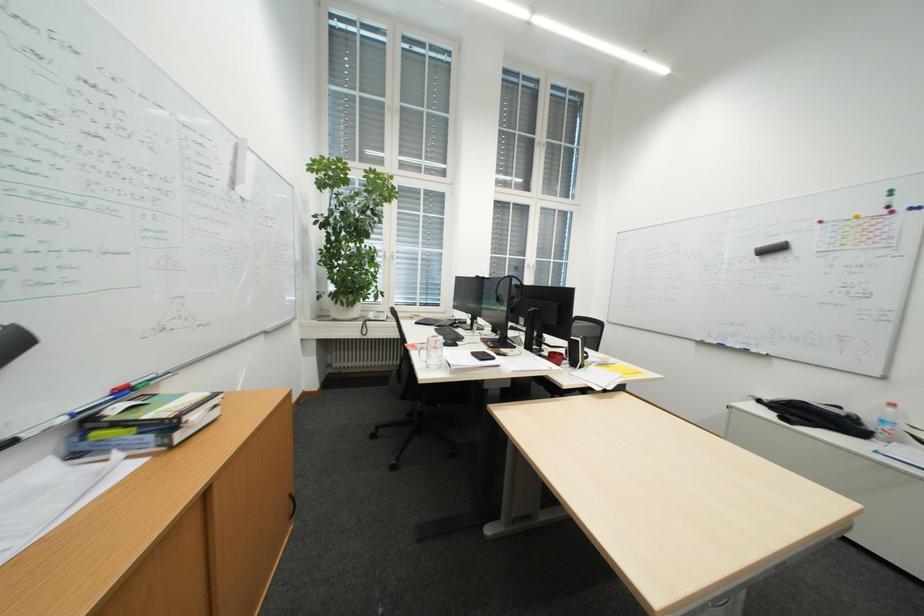
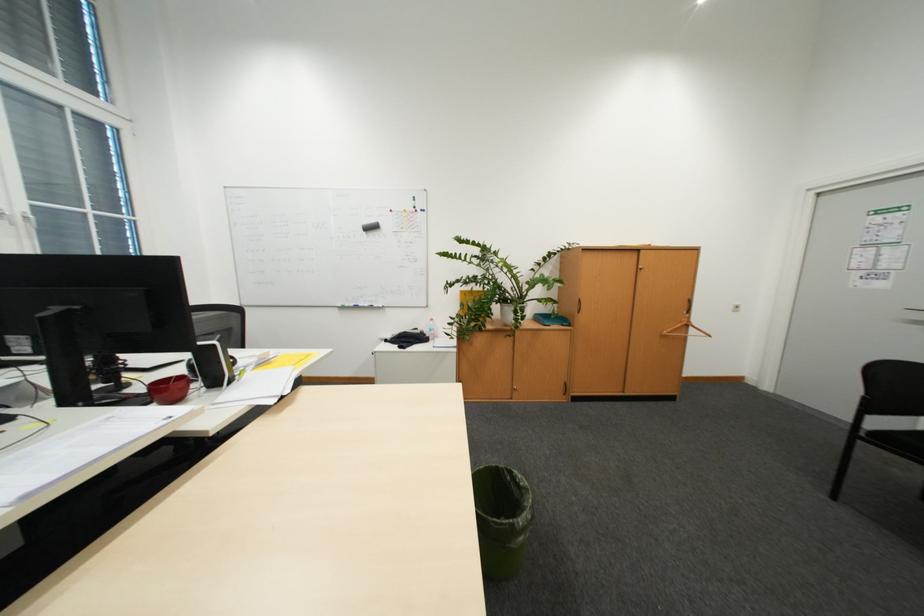
Question: The images are taken continuously from a first-person perspective. In which direction is your viewpoint rotating?

Choices:
 (A) Left
 (B) Right
 (C) Up
 (D) Down

Answer: (B)